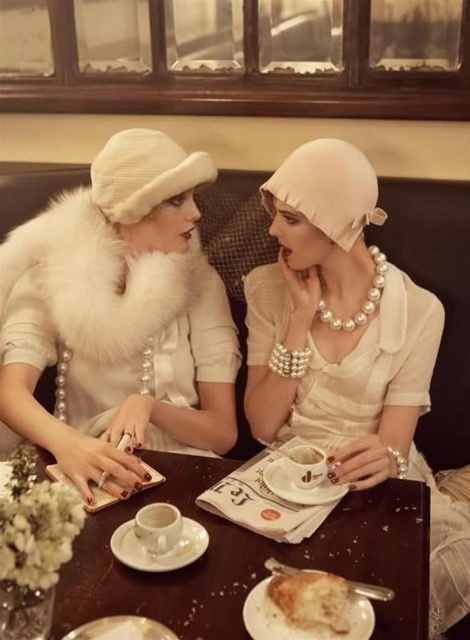
Question: Considering the real-world distances, which object is closest to the golden brown crusty bread at lower center?

Choices:
 (A) white fur collar at center
 (B) pearl white fabric dress at center

Answer: (B)

Question: Can you confirm if wooden table at center is positioned to the right of golden brown crusty bread at lower center?

Choices:
 (A) yes
 (B) no

Answer: (B)

Question: Is white fur collar at center closer to camera compared to wooden table at center?

Choices:
 (A) no
 (B) yes

Answer: (A)

Question: Estimate the real-world distances between objects in this image. Which object is farther from the golden brown crusty bread at lower center?

Choices:
 (A) white fur collar at center
 (B) wooden table at center
 (C) pearl white fabric dress at center

Answer: (A)

Question: Which point appears farthest from the camera in this image?

Choices:
 (A) (204, 592)
 (B) (188, 202)
 (C) (248, 372)
 (D) (313, 612)

Answer: (C)

Question: Can you confirm if wooden table at center is wider than pearl white fabric dress at center?

Choices:
 (A) yes
 (B) no

Answer: (A)